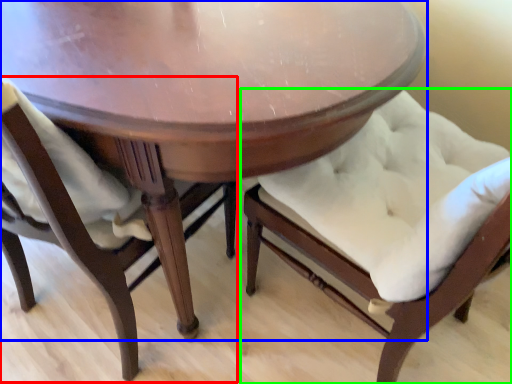
Question: Which object is positioned farthest from chair (highlighted by a red box)? Select from table (highlighted by a blue box) and chair (highlighted by a green box).

Choices:
 (A) table
 (B) chair

Answer: (B)